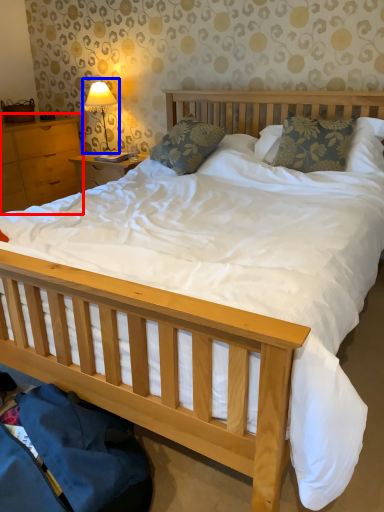
Question: Which object is further to the camera taking this photo, nightstand (highlighted by a red box) or table lamp (highlighted by a blue box)?

Choices:
 (A) nightstand
 (B) table lamp

Answer: (B)